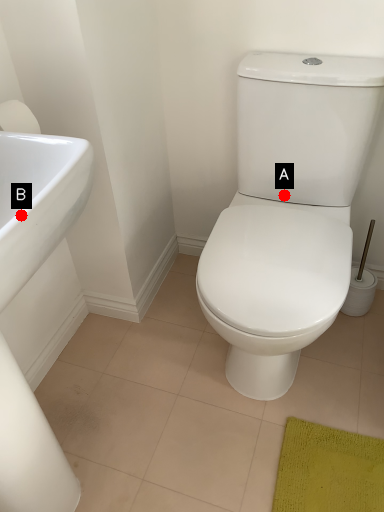
Question: Two points are circled on the image, labeled by A and B beside each circle. Which point is closer to the camera?

Choices:
 (A) A is closer
 (B) B is closer

Answer: (B)